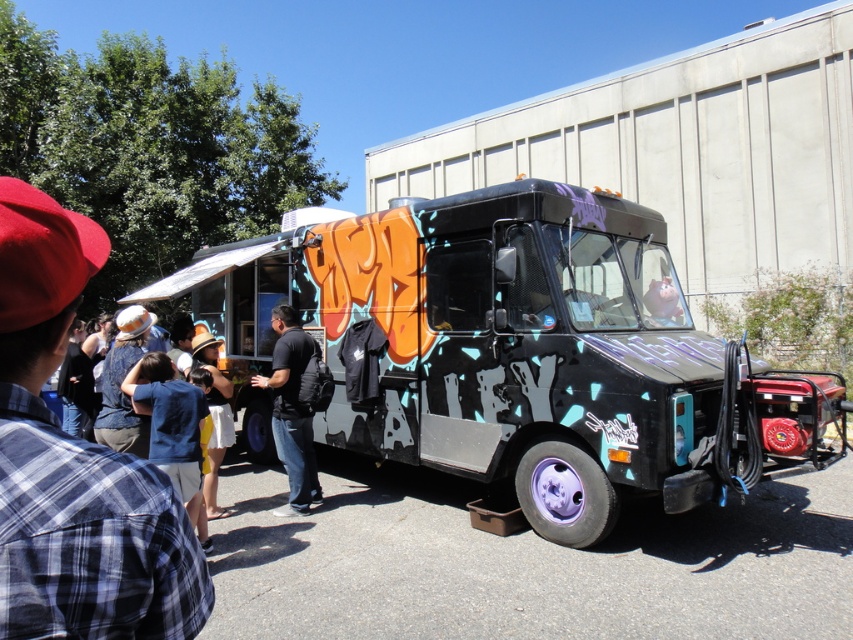
You are a customer at the food truck and see two shirts hanging on the back of the truck. The plaid fabric shirt at left and the yellow cotton shirt at center. Which shirt is covering the other one?

The plaid fabric shirt at left is positioned over the yellow cotton shirt at center, so it is covering the yellow cotton shirt at center.